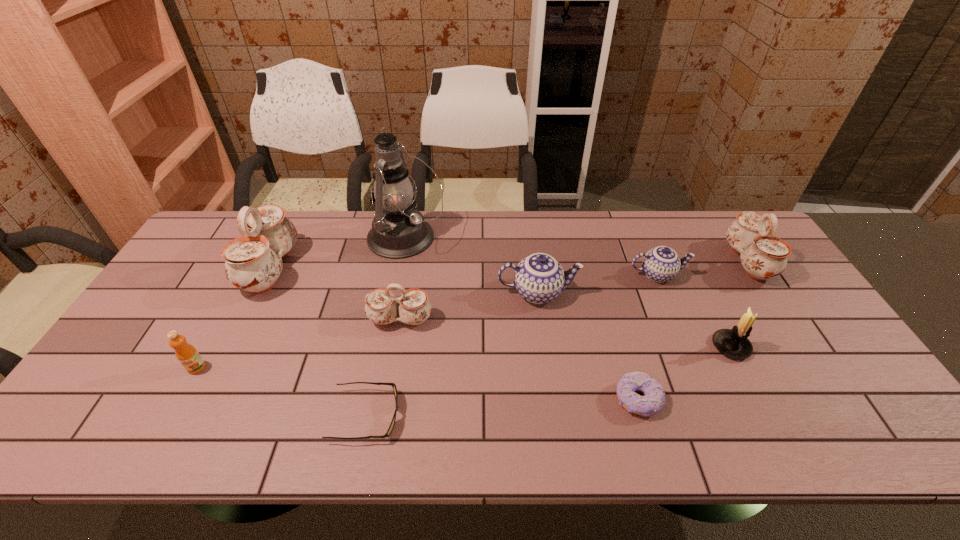
Identify the location of orange juice. The image size is (960, 540). (188, 356).

The image size is (960, 540). Identify the location of the smaller blue chinaware. (660, 264).

Where is `the eighth tallest object`? The image size is (960, 540). the eighth tallest object is located at coordinates (660, 264).

Locate an element on the screen. The image size is (960, 540). doughnut is located at coordinates (650, 404).

Where is `brown doughnut`? This screenshot has height=540, width=960. brown doughnut is located at coordinates (650, 404).

In order to click on the shortest object in this screenshot , I will do `click(393, 385)`.

Locate an element on the screen. free point located on the right of the tallest object is located at coordinates (498, 238).

Locate an element on the screen. The width and height of the screenshot is (960, 540). blank space located by the handle of the tallest chinaware is located at coordinates point(422,268).

Locate an element on the screen. The image size is (960, 540). free point located 0.280m by the handle of the second tallest chinaware is located at coordinates (640, 261).

At what (x,y) coordinates should I click in order to perform the action: click on free space located by the handle of the second tallest chinaware. Please return your answer as a coordinate pair (x, y). Image resolution: width=960 pixels, height=540 pixels. Looking at the image, I should click on (675, 261).